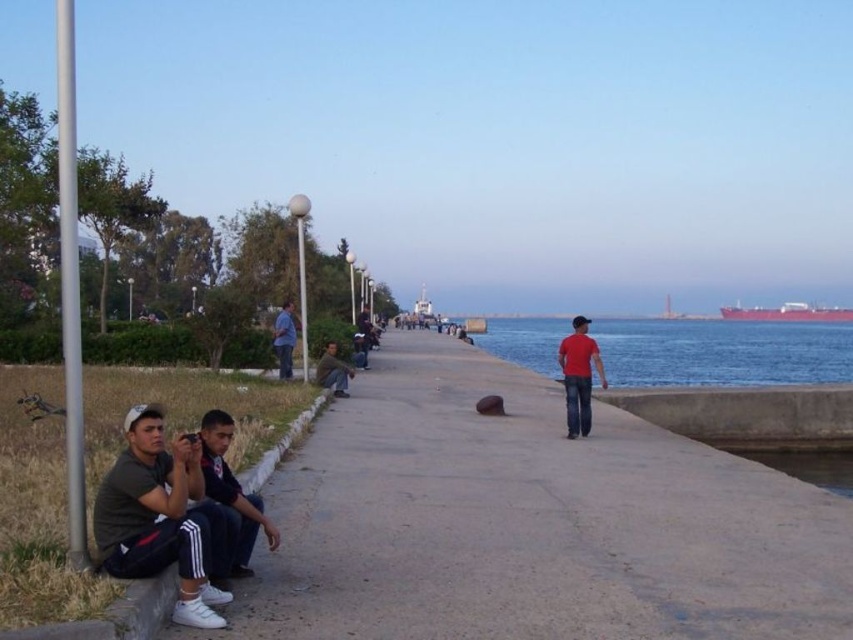
Does matte red shirt at center have a smaller size compared to blue jeans at center?

Incorrect, matte red shirt at center is not smaller in size than blue jeans at center.

Does matte red shirt at center come in front of blue jeans at center?

Yes.

Where is `matte red shirt at center`? The image size is (853, 640). matte red shirt at center is located at coordinates (578, 376).

Can you confirm if dark green jersey at lower left is positioned below dark blue jeans at center?

Yes.

Who is more forward, (x=187, y=570) or (x=364, y=348)?

Point (x=187, y=570) is in front.

Where is `dark green jersey at lower left`? The image size is (853, 640). dark green jersey at lower left is located at coordinates (161, 516).

Does concrete at left appear on the right side of dark blue jeans at lower left?

Indeed, concrete at left is positioned on the right side of dark blue jeans at lower left.

Is point (714, 580) behind point (239, 524)?

Yes, it is.

Consider the image. Measure the distance between point (515, 490) and camera.

Point (515, 490) is 9.33 meters away from camera.

You are a GUI agent. You are given a task and a screenshot of the screen. Output one action in this format:
    pyautogui.click(x=<x>, y=<y>)
    Task: Click on the concrete at left
    The image size is (853, 640).
    Given the screenshot: What is the action you would take?
    pyautogui.click(x=531, y=522)